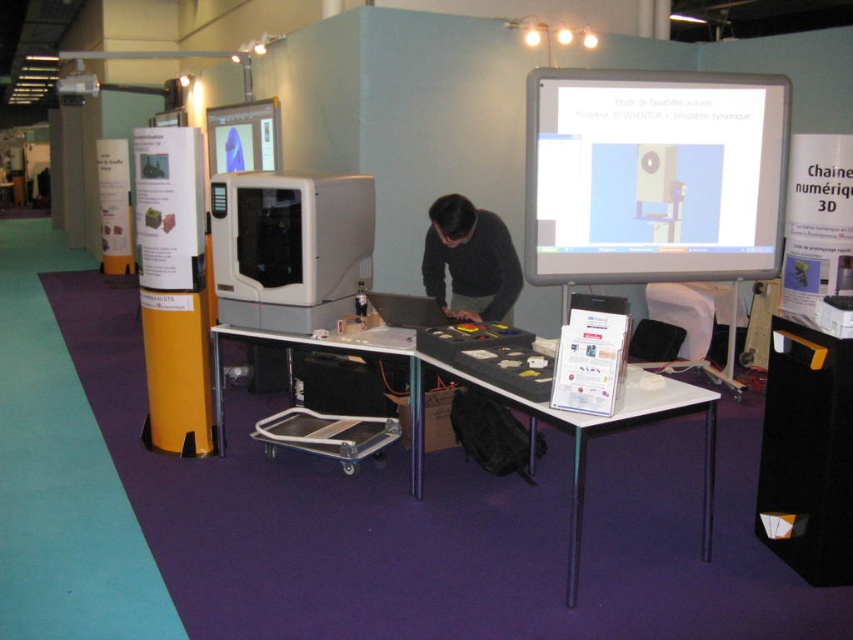
Question: Is matte white projector screen at upper right closer to the viewer compared to dark gray sweater at center?

Choices:
 (A) yes
 (B) no

Answer: (B)

Question: Which point is closer to the camera?

Choices:
 (A) (659, 156)
 (B) (440, 326)
 (C) (489, 246)
 (D) (223, 426)

Answer: (B)

Question: Which object appears farthest from the camera in this image?

Choices:
 (A) dark gray sweater at center
 (B) metallic silver table at center
 (C) white plastic table at center
 (D) matte white projector screen at upper right

Answer: (D)

Question: From the image, what is the correct spatial relationship of dark gray sweater at center in relation to matte white computer monitor at upper center?

Choices:
 (A) below
 (B) above

Answer: (A)

Question: Which of these objects is positioned farthest from the metallic silver table at center?

Choices:
 (A) white plastic table at center
 (B) matte white projector screen at upper right

Answer: (B)

Question: Can you confirm if white plastic table at center is positioned above dark gray sweater at center?

Choices:
 (A) yes
 (B) no

Answer: (B)